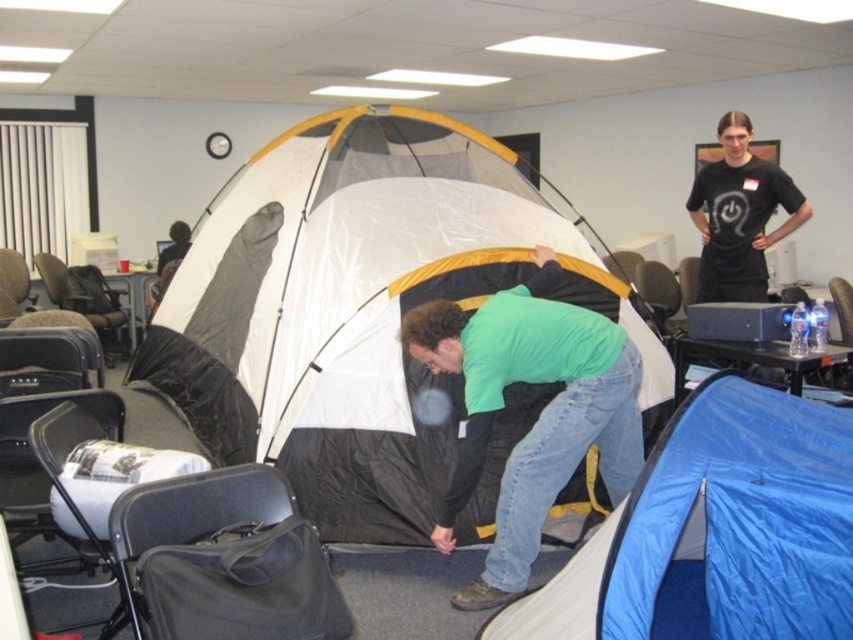
You are standing at the position of point [758,228] and want to walk to the door located at point [595,428]. Is the door in front of you?

Yes, the door at point [595,428] is in front of you because it is located in front of your current position at point [758,228].

You are planning to place a rectangular box that is 1 meter wide between the blue tarp at lower right and the green matte shirt at center. Based on their widths, will the box fit between them without overlapping?

The blue tarp at lower right might be wider than green matte shirt at center, so the 1 meter wide box may not fit between them if the total width of both objects exceeds the available space. However, without exact measurements, it is uncertain.

You are standing in the room and see the point marked at coordinates (538, 416). What object is located at that point?

The point at coordinates (538, 416) corresponds to the green matte shirt at center.